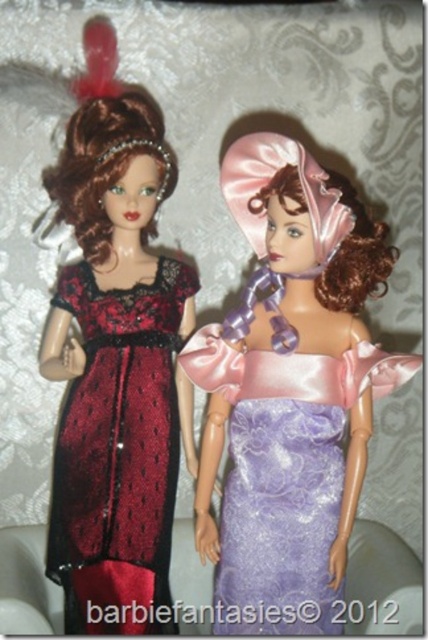
Question: Does lavender satin dress at center have a greater width compared to matte lace dress at left?

Choices:
 (A) no
 (B) yes

Answer: (B)

Question: Is lavender satin dress at center wider than matte lace dress at left?

Choices:
 (A) no
 (B) yes

Answer: (B)

Question: Is lavender satin dress at center above matte lace dress at left?

Choices:
 (A) no
 (B) yes

Answer: (A)

Question: Which of the following is the farthest from the observer?

Choices:
 (A) (71, 561)
 (B) (214, 381)

Answer: (B)

Question: Which of the following is the farthest from the observer?

Choices:
 (A) matte lace dress at left
 (B) lavender satin dress at center

Answer: (A)